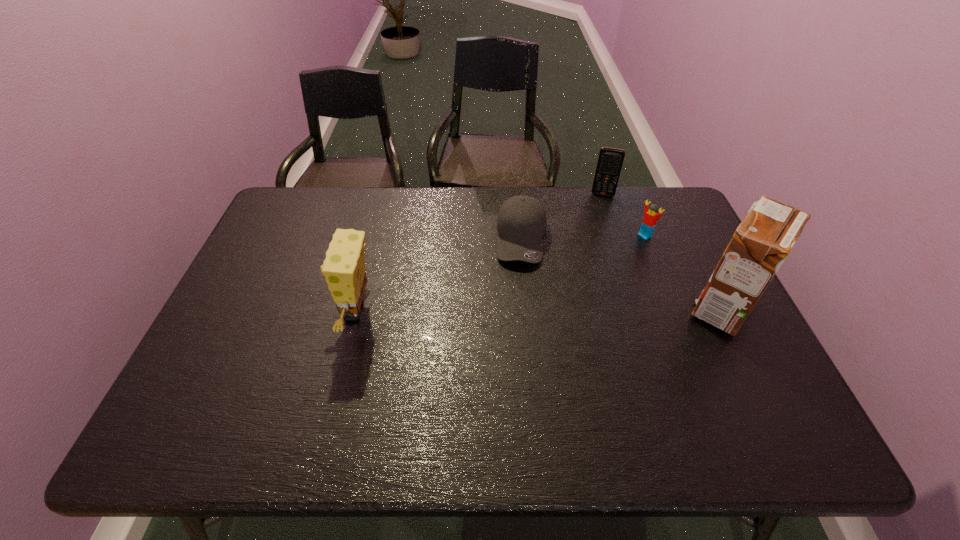
Locate an element on the screen. the second tallest object is located at coordinates (344, 269).

Where is `the leftmost object`? This screenshot has height=540, width=960. the leftmost object is located at coordinates (344, 269).

Identify the location of carton. (764, 239).

What are the coordinates of `the rightmost object` in the screenshot? It's located at (764, 239).

Where is `baseball cap`? This screenshot has width=960, height=540. baseball cap is located at coordinates (521, 224).

You are a GUI agent. You are given a task and a screenshot of the screen. Output one action in this format:
    pyautogui.click(x=<x>, y=<y>)
    Task: Click on the fourth object from left to right
    The height and width of the screenshot is (540, 960).
    Given the screenshot: What is the action you would take?
    pyautogui.click(x=649, y=221)

Find the location of a particular element. the third shortest object is located at coordinates (610, 160).

Where is `cellular telephone`? This screenshot has width=960, height=540. cellular telephone is located at coordinates (610, 160).

This screenshot has height=540, width=960. What are the coordinates of `free space located on the face of the leftmost object` in the screenshot? It's located at (230, 312).

Find the location of a particular element. Image resolution: width=960 pixels, height=540 pixels. free space located on the face of the leftmost object is located at coordinates (309, 312).